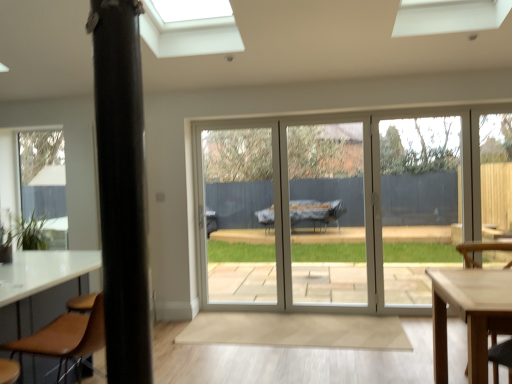
Question: Does point (150, 347) appear closer or farther from the camera than point (505, 243)?

Choices:
 (A) closer
 (B) farther

Answer: (A)

Question: Relative to wooden chair at lower right, which is the 2th chair from front to back, is black matte pole at left in front or behind?

Choices:
 (A) behind
 (B) front

Answer: (B)

Question: Estimate the real-world distances between objects in this image. Which object is farther from the green matte plant at lower left?

Choices:
 (A) brown leather chair at lower left, which ranks as the first chair in left-to-right order
 (B) black matte pole at left
 (C) wooden chair at lower right, the 1th chair in the right-to-left sequence

Answer: (C)

Question: Estimate the real-world distances between objects in this image. Which object is closer to the green matte plant at lower left?

Choices:
 (A) black matte pole at left
 (B) wooden chair at lower right, the 1th chair in the right-to-left sequence
 (C) brown leather chair at lower left, which is the 2th chair from right to left

Answer: (C)